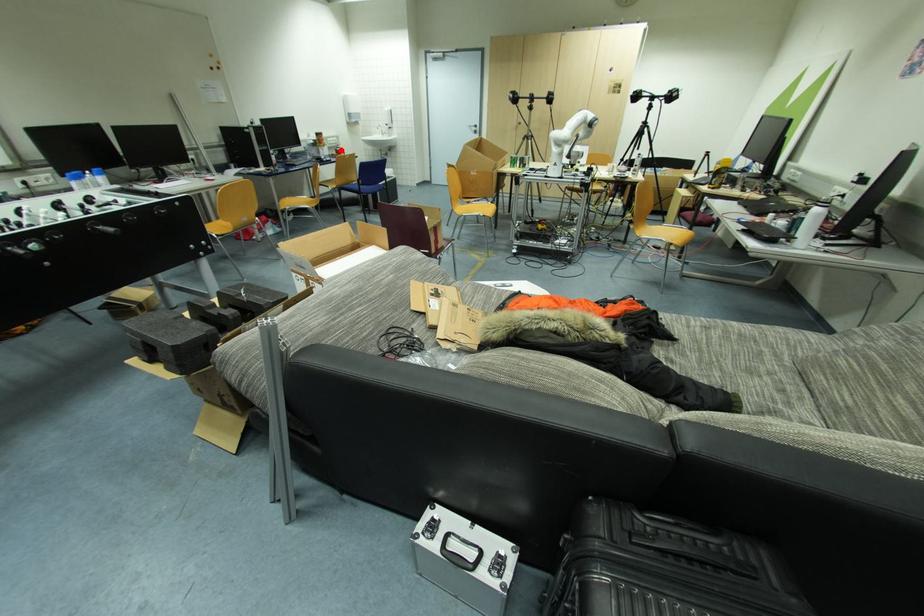
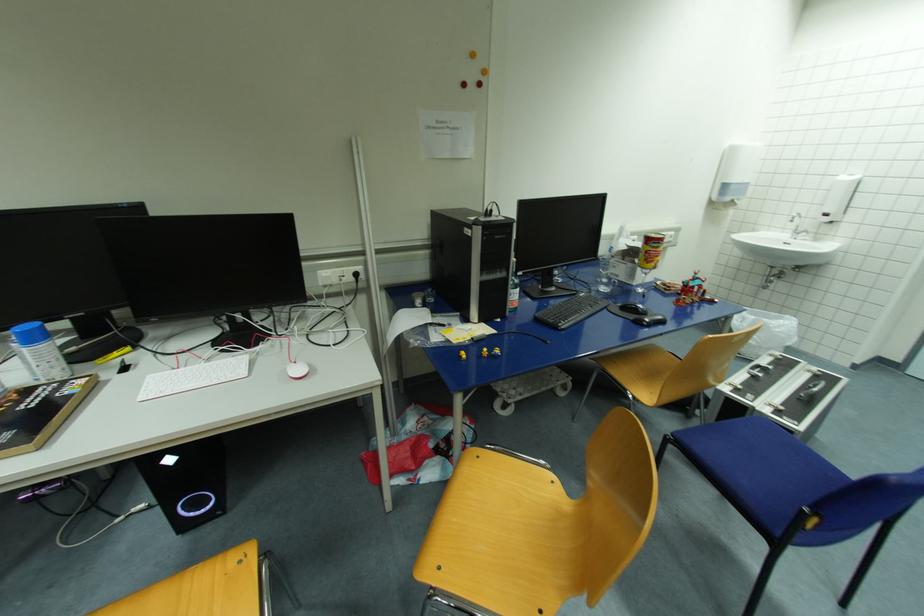
Find the pixel in the second image that matches the highlighted location in the first image.

(696, 285)